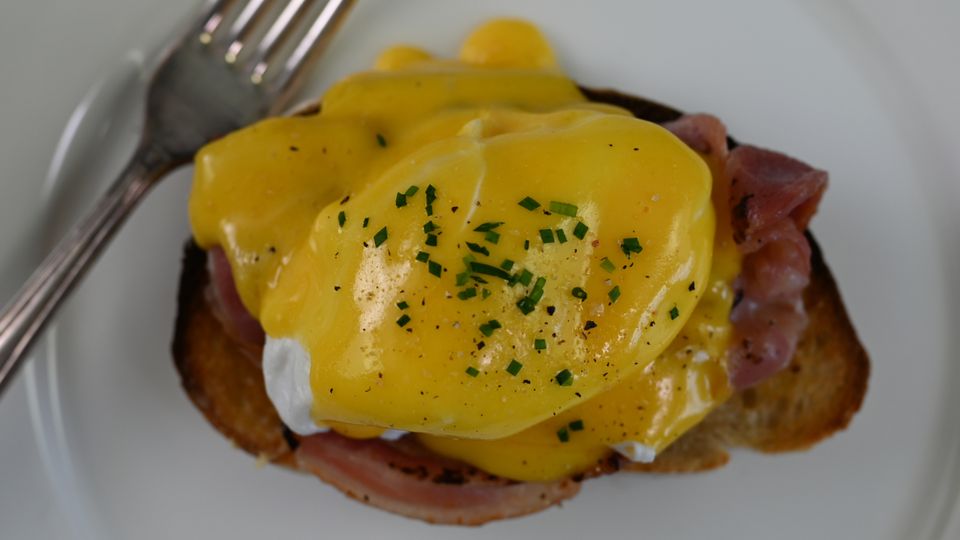
This screenshot has width=960, height=540. I want to click on fork, so click(x=204, y=83).